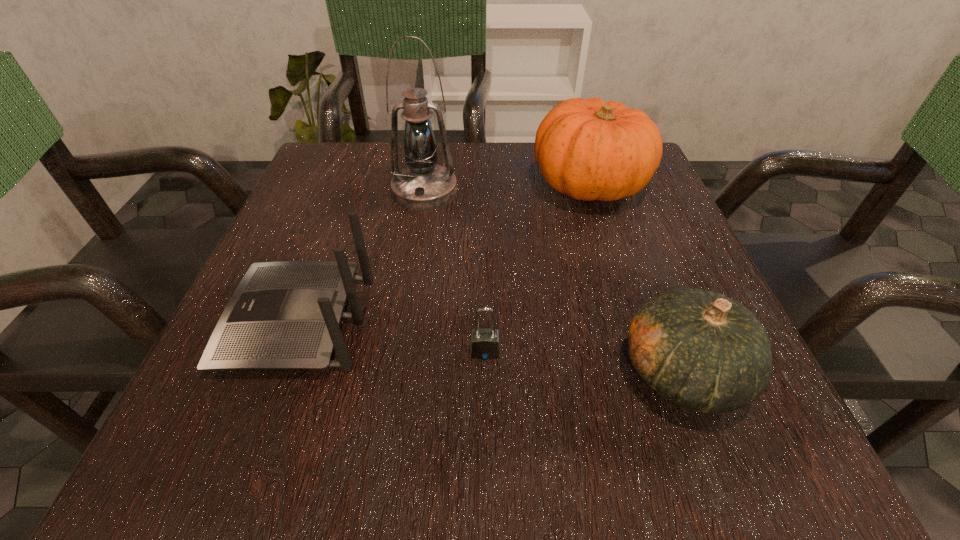
The image size is (960, 540). Find the location of `oil lamp that is at the far edge`. oil lamp that is at the far edge is located at coordinates (423, 185).

What are the coordinates of `pumpkin at the far edge` in the screenshot? It's located at (589, 149).

Where is `object located in the near edge section of the desktop`? The width and height of the screenshot is (960, 540). object located in the near edge section of the desktop is located at coordinates (706, 352).

Where is `object located in the left edge section of the desktop`? This screenshot has height=540, width=960. object located in the left edge section of the desktop is located at coordinates click(x=283, y=315).

Find the location of a particular element. pumpkin at the right edge is located at coordinates (589, 149).

Where is `gourd that is at the right edge`? The image size is (960, 540). gourd that is at the right edge is located at coordinates (706, 352).

Locate an element on the screen. object present at the far right corner is located at coordinates pyautogui.click(x=589, y=149).

This screenshot has height=540, width=960. Find the location of `object positioned at the near right corner`. object positioned at the near right corner is located at coordinates (706, 352).

Where is `vacant space at the far edge of the desktop`? vacant space at the far edge of the desktop is located at coordinates (475, 166).

I want to click on vacant space at the near edge, so click(x=463, y=453).